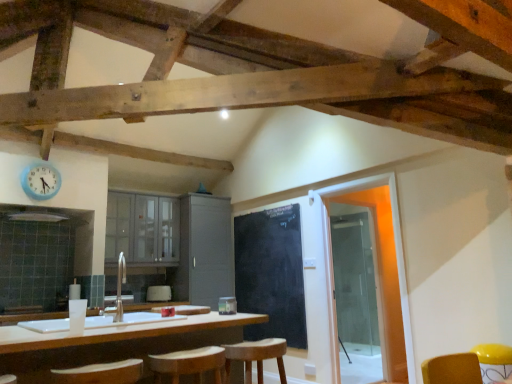
Identify the location of vacant point above black chalkboard at center (from a real-world perspective). (269, 208).